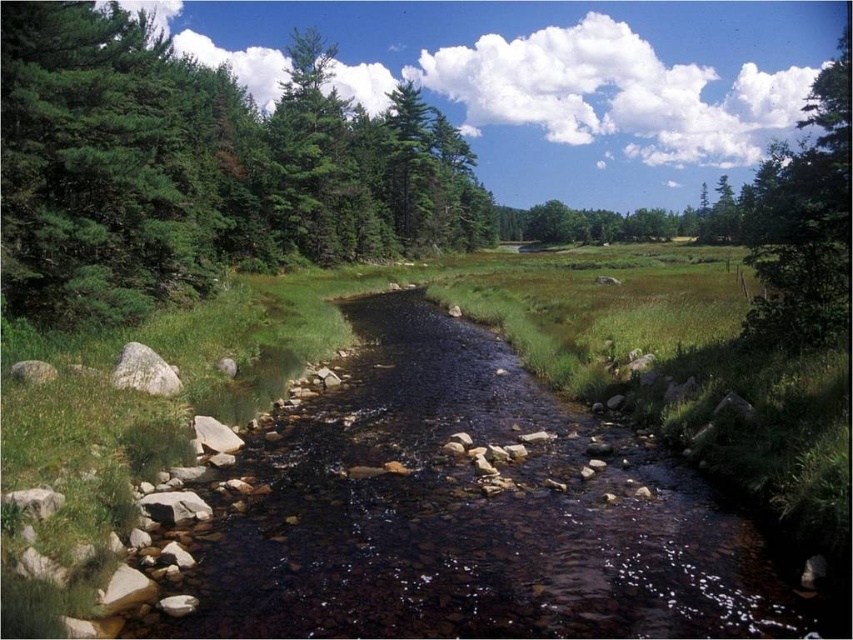
Is smooth rock stream at center positioned before green matte tree at upper right?

Yes, smooth rock stream at center is in front of green matte tree at upper right.

Does smooth rock stream at center appear on the right side of green matte tree at upper right?

No, smooth rock stream at center is not to the right of green matte tree at upper right.

Where is `smooth rock stream at center`? smooth rock stream at center is located at coordinates (473, 515).

Can you confirm if gray smooth rock at left is positioned to the right of gray smooth rock at lower left?

Correct, you'll find gray smooth rock at left to the right of gray smooth rock at lower left.

Does gray smooth rock at left have a greater width compared to gray smooth rock at lower left?

Yes, gray smooth rock at left is wider than gray smooth rock at lower left.

Find the location of a particular element. gray smooth rock at left is located at coordinates (144, 371).

At what (x,y) coordinates should I click in order to perform the action: click on gray smooth rock at left. Please return your answer as a coordinate pair (x, y). The height and width of the screenshot is (640, 853). Looking at the image, I should click on (144, 371).

Between green matte tree at left and gray smooth rock at left, which one is positioned higher?

green matte tree at left is higher up.

Is green matte tree at left smaller than gray smooth rock at left?

No, green matte tree at left is not smaller than gray smooth rock at left.

Measure the distance between point (3, 252) and camera.

Point (3, 252) is 102.93 meters away from camera.

Identify the location of green matte tree at left. The width and height of the screenshot is (853, 640). (201, 168).